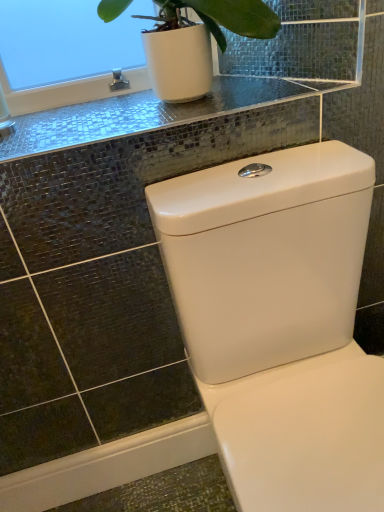
What do you see at coordinates (279, 322) in the screenshot?
I see `white glossy toilet at center` at bounding box center [279, 322].

Find the location of `white glossy toilet at center`. white glossy toilet at center is located at coordinates (279, 322).

Where is `shiny glass counter top at upper center`? Image resolution: width=384 pixels, height=512 pixels. shiny glass counter top at upper center is located at coordinates (139, 115).

The width and height of the screenshot is (384, 512). Describe the element at coordinates (139, 115) in the screenshot. I see `shiny glass counter top at upper center` at that location.

In order to click on white glossy toilet at center in this screenshot , I will do `click(279, 322)`.

Can you confirm if white glossy toilet at center is positioned to the left of shiny glass counter top at upper center?

Incorrect, white glossy toilet at center is not on the left side of shiny glass counter top at upper center.

Considering the relative positions of white glossy toilet at center and shiny glass counter top at upper center in the image provided, is white glossy toilet at center in front of shiny glass counter top at upper center?

Yes, it is in front of shiny glass counter top at upper center.

Which point is more forward, [359,193] or [257,102]?

The point [359,193] is closer.

From the picture: From the image's perspective, which is above, white glossy toilet at center or shiny glass counter top at upper center?

shiny glass counter top at upper center is shown above in the image.

From a real-world perspective, is white glossy toilet at center on top of shiny glass counter top at upper center?

No, from a real-world perspective, white glossy toilet at center is not over shiny glass counter top at upper center

Does white glossy toilet at center have a lesser width compared to shiny glass counter top at upper center?

Incorrect, the width of white glossy toilet at center is not less than that of shiny glass counter top at upper center.

Can you confirm if white glossy toilet at center is taller than shiny glass counter top at upper center?

Correct, white glossy toilet at center is much taller as shiny glass counter top at upper center.

Which of these two, white glossy toilet at center or shiny glass counter top at upper center, is smaller?

With smaller size is shiny glass counter top at upper center.

Looking at this image, can shiny glass counter top at upper center be found inside white glossy toilet at center?

No, white glossy toilet at center does not contain shiny glass counter top at upper center.

Is white glossy toilet at center directly adjacent to shiny glass counter top at upper center?

There is a gap between white glossy toilet at center and shiny glass counter top at upper center.

In the scene shown: Does white glossy toilet at center turn towards shiny glass counter top at upper center?

No, white glossy toilet at center is not facing towards shiny glass counter top at upper center.

How many degrees apart are the facing directions of white glossy toilet at center and shiny glass counter top at upper center?

They differ by 0.54 degrees in their facing directions.

Where is `toilet that appears in front of the shiny glass counter top at upper center`? This screenshot has width=384, height=512. toilet that appears in front of the shiny glass counter top at upper center is located at coordinates (279, 322).

Is shiny glass counter top at upper center at the left side of white glossy toilet at center?

Correct, you'll find shiny glass counter top at upper center to the left of white glossy toilet at center.

Does shiny glass counter top at upper center come behind white glossy toilet at center?

Yes, shiny glass counter top at upper center is further from the viewer.

Which is behind, point (29, 149) or point (279, 292)?

Point (279, 292)

From the image's perspective, which is above, shiny glass counter top at upper center or white glossy toilet at center?

shiny glass counter top at upper center appears higher in the image.

From a real-world perspective, between shiny glass counter top at upper center and white glossy toilet at center, who is vertically higher?

shiny glass counter top at upper center, from a real-world perspective.

Considering the sizes of objects shiny glass counter top at upper center and white glossy toilet at center in the image provided, who is wider, shiny glass counter top at upper center or white glossy toilet at center?

white glossy toilet at center is wider.

Between shiny glass counter top at upper center and white glossy toilet at center, which one has less height?

Standing shorter between the two is shiny glass counter top at upper center.

Considering the sizes of objects shiny glass counter top at upper center and white glossy toilet at center in the image provided, who is bigger, shiny glass counter top at upper center or white glossy toilet at center?

white glossy toilet at center.

Is shiny glass counter top at upper center not inside white glossy toilet at center?

Yes, shiny glass counter top at upper center is located beyond the bounds of white glossy toilet at center.

Does shiny glass counter top at upper center touch white glossy toilet at center?

No, shiny glass counter top at upper center is not with white glossy toilet at center.

Could you tell me if shiny glass counter top at upper center is facing white glossy toilet at center?

No, shiny glass counter top at upper center is not turned towards white glossy toilet at center.

The height and width of the screenshot is (512, 384). What are the coordinates of `counter top located above the white glossy toilet at center (from the image's perspective)` in the screenshot? It's located at (139, 115).

The height and width of the screenshot is (512, 384). In order to click on toilet below the shiny glass counter top at upper center (from a real-world perspective) in this screenshot , I will do `click(279, 322)`.

The image size is (384, 512). Find the location of `toilet that is in front of the shiny glass counter top at upper center`. toilet that is in front of the shiny glass counter top at upper center is located at coordinates (279, 322).